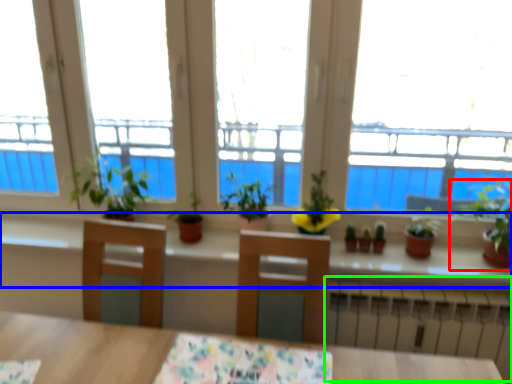
Question: Estimate the real-world distances between objects in this image. Which object is closer to houseplant (highlighted by a red box), window sill (highlighted by a blue box) or radiator (highlighted by a green box)?

Choices:
 (A) window sill
 (B) radiator

Answer: (A)